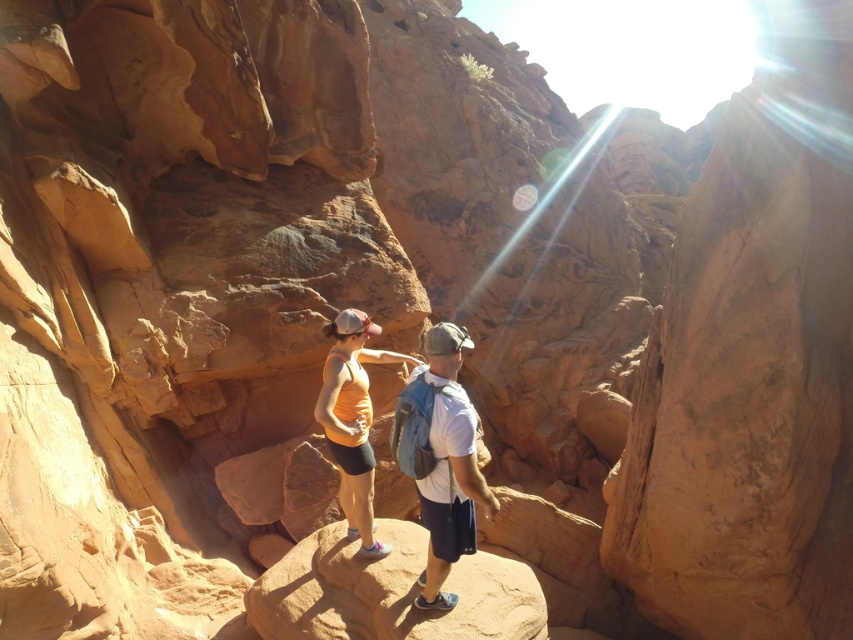
Question: Does white matte shirt at center appear over orange fabric tank top at center?

Choices:
 (A) no
 (B) yes

Answer: (A)

Question: Is white matte shirt at center to the left of orange fabric tank top at center from the viewer's perspective?

Choices:
 (A) yes
 (B) no

Answer: (B)

Question: Is white matte shirt at center smaller than orange fabric tank top at center?

Choices:
 (A) no
 (B) yes

Answer: (B)

Question: Which of the following is the farthest from the observer?

Choices:
 (A) (439, 561)
 (B) (369, 349)

Answer: (B)